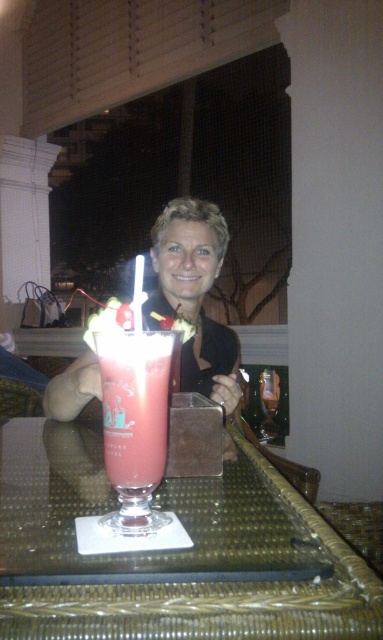
You are a delivery person who needs to place a small package on the clear glass table at center. Based on the coordinates provided, can you confirm the exact location where the table is positioned?

The clear glass table at center is positioned at coordinates point (222, 580).